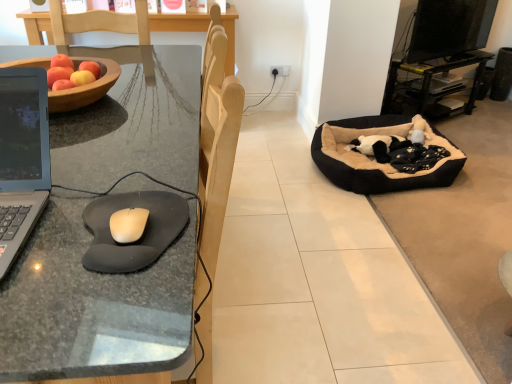
Question: From a real-world perspective, is black rubber mouse pad at left below black foam mousepad at left?

Choices:
 (A) no
 (B) yes

Answer: (B)

Question: Is black rubber mouse pad at left oriented away from black foam mousepad at left?

Choices:
 (A) yes
 (B) no

Answer: (B)

Question: Is black rubber mouse pad at left wider than black foam mousepad at left?

Choices:
 (A) yes
 (B) no

Answer: (A)

Question: From the image's perspective, is black rubber mouse pad at left located beneath black foam mousepad at left?

Choices:
 (A) yes
 (B) no

Answer: (A)

Question: Is black rubber mouse pad at left thinner than black foam mousepad at left?

Choices:
 (A) no
 (B) yes

Answer: (A)

Question: Considering the relative positions of black rubber mouse pad at left and black foam mousepad at left in the image provided, is black rubber mouse pad at left to the left of black foam mousepad at left from the viewer's perspective?

Choices:
 (A) no
 (B) yes

Answer: (B)

Question: Is black foam mousepad at left in contact with black plush dog bed at right?

Choices:
 (A) no
 (B) yes

Answer: (A)

Question: Does black foam mousepad at left appear on the right side of black plush dog bed at right?

Choices:
 (A) no
 (B) yes

Answer: (A)

Question: Can you confirm if black foam mousepad at left is positioned to the left of black plush dog bed at right?

Choices:
 (A) no
 (B) yes

Answer: (B)

Question: From a real-world perspective, is black foam mousepad at left physically below black plush dog bed at right?

Choices:
 (A) no
 (B) yes

Answer: (A)

Question: From the image's perspective, is black foam mousepad at left below black plush dog bed at right?

Choices:
 (A) no
 (B) yes

Answer: (B)

Question: Is black foam mousepad at left wider than black plush dog bed at right?

Choices:
 (A) yes
 (B) no

Answer: (B)

Question: From a real-world perspective, is black fabric speaker at upper right physically below wooden bowl at left?

Choices:
 (A) yes
 (B) no

Answer: (A)